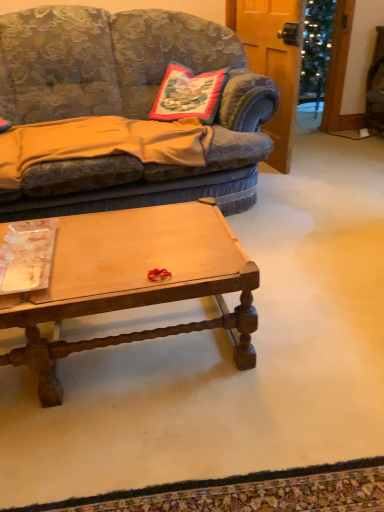
This screenshot has height=512, width=384. Describe the element at coordinates (189, 94) in the screenshot. I see `embroidered fabric pillow at center` at that location.

Where is `velvet fabric couch at center`? Image resolution: width=384 pixels, height=512 pixels. velvet fabric couch at center is located at coordinates [127, 106].

Between light brown wood coffee table at center and embroidered fabric pillow at center, which one has larger size?

With larger size is light brown wood coffee table at center.

From a real-world perspective, is light brown wood coffee table at center located beneath embroidered fabric pillow at center?

Indeed, from a real-world perspective, light brown wood coffee table at center is positioned beneath embroidered fabric pillow at center.

Is point (253, 262) closer or farther from the camera than point (196, 90)?

Clearly, point (253, 262) is closer to the camera than point (196, 90).

Relative to embroidered fabric pillow at center, is light brown wood coffee table at center in front or behind?

Visually, light brown wood coffee table at center is located in front of embroidered fabric pillow at center.

Considering the sizes of objects embroidered fabric pillow at center and velvet fabric couch at center in the image provided, who is smaller, embroidered fabric pillow at center or velvet fabric couch at center?

Smaller between the two is embroidered fabric pillow at center.

Is embroidered fabric pillow at center situated inside velvet fabric couch at center or outside?

embroidered fabric pillow at center lies within the bounds of velvet fabric couch at center.

From a real-world perspective, which object stands above the other?

embroidered fabric pillow at center is physically above.

Locate an element on the screen. This screenshot has width=384, height=512. pillow that is on the right side of velvet fabric couch at center is located at coordinates click(189, 94).

Can we say velvet fabric couch at center lies outside embroidered fabric pillow at center?

Yes, velvet fabric couch at center is located beyond the bounds of embroidered fabric pillow at center.

Considering the relative sizes of velvet fabric couch at center and embroidered fabric pillow at center in the image provided, is velvet fabric couch at center wider than embroidered fabric pillow at center?

Correct, the width of velvet fabric couch at center exceeds that of embroidered fabric pillow at center.

Where is `studio couch in front of the embroidered fabric pillow at center`? The image size is (384, 512). studio couch in front of the embroidered fabric pillow at center is located at coordinates (127, 106).

From the image's perspective, between velvet fabric couch at center and embroidered fabric pillow at center, who is located below?

velvet fabric couch at center, from the image's perspective.

Based on the photo, is orange cotton blanket at left facing towards velvet fabric couch at center?

Yes, orange cotton blanket at left is turned towards velvet fabric couch at center.

Can you confirm if orange cotton blanket at left is thinner than velvet fabric couch at center?

Correct, the width of orange cotton blanket at left is less than that of velvet fabric couch at center.

Looking at this image, is orange cotton blanket at left at the right side of velvet fabric couch at center?

No, orange cotton blanket at left is not to the right of velvet fabric couch at center.

Does orange cotton blanket at left have a smaller size compared to velvet fabric couch at center?

Correct, orange cotton blanket at left occupies less space than velvet fabric couch at center.

From a real-world perspective, is velvet fabric couch at center beneath light brown wood coffee table at center?

Incorrect, from a real-world perspective, velvet fabric couch at center is higher than light brown wood coffee table at center.

From the image's perspective, which object appears higher, velvet fabric couch at center or light brown wood coffee table at center?

From the image's view, velvet fabric couch at center is above.

Considering the positions of points (94, 25) and (102, 298), is point (94, 25) closer to camera compared to point (102, 298)?

No, it is not.

Which object is closer to the camera, velvet fabric couch at center or light brown wood coffee table at center?

light brown wood coffee table at center is more forward.

Does orange cotton blanket at left contain light brown wood coffee table at center?

Definitely not — light brown wood coffee table at center is not inside orange cotton blanket at left.

From the image's perspective, which object appears higher, orange cotton blanket at left or light brown wood coffee table at center?

orange cotton blanket at left, from the image's perspective.

Would you say orange cotton blanket at left is a long distance from light brown wood coffee table at center?

No.

Which object is thinner, orange cotton blanket at left or light brown wood coffee table at center?

light brown wood coffee table at center is thinner.

From the image's perspective, between light brown wood coffee table at center and orange cotton blanket at left, which one is located above?

orange cotton blanket at left, from the image's perspective.

Considering the relative positions of light brown wood coffee table at center and orange cotton blanket at left in the image provided, is light brown wood coffee table at center to the right of orange cotton blanket at left from the viewer's perspective?

Yes, light brown wood coffee table at center is to the right of orange cotton blanket at left.

Considering the sizes of objects light brown wood coffee table at center and orange cotton blanket at left in the image provided, who is shorter, light brown wood coffee table at center or orange cotton blanket at left?

orange cotton blanket at left.

Considering the sizes of objects light brown wood coffee table at center and orange cotton blanket at left in the image provided, who is smaller, light brown wood coffee table at center or orange cotton blanket at left?

With smaller size is orange cotton blanket at left.

Locate an element on the screen. The height and width of the screenshot is (512, 384). coffee table beneath the embroidered fabric pillow at center (from a real-world perspective) is located at coordinates (133, 282).

At what (x,y) coordinates should I click in order to perform the action: click on studio couch in front of the embroidered fabric pillow at center. Please return your answer as a coordinate pair (x, y). Looking at the image, I should click on (127, 106).

Estimate the real-world distances between objects in this image. Which object is closer to velvet fabric couch at center, light brown wood coffee table at center or embroidered fabric pillow at center?

embroidered fabric pillow at center is positioned closer to the anchor velvet fabric couch at center.

Based on their spatial positions, is light brown wood coffee table at center or orange cotton blanket at left further from embroidered fabric pillow at center?

light brown wood coffee table at center is positioned further to the anchor embroidered fabric pillow at center.

Considering their positions, is velvet fabric couch at center positioned further to embroidered fabric pillow at center than light brown wood coffee table at center?

Among the two, light brown wood coffee table at center is located further to embroidered fabric pillow at center.

Looking at the image, which one is located further to light brown wood coffee table at center, embroidered fabric pillow at center or orange cotton blanket at left?

The object further to light brown wood coffee table at center is embroidered fabric pillow at center.

Based on their spatial positions, is orange cotton blanket at left or velvet fabric couch at center closer to embroidered fabric pillow at center?

velvet fabric couch at center lies closer to embroidered fabric pillow at center than the other object.

In the scene shown: Considering their positions, is embroidered fabric pillow at center positioned further to velvet fabric couch at center than light brown wood coffee table at center?

light brown wood coffee table at center lies further to velvet fabric couch at center than the other object.

When comparing their distances from light brown wood coffee table at center, does orange cotton blanket at left or velvet fabric couch at center seem closer?

The object closer to light brown wood coffee table at center is orange cotton blanket at left.

Looking at the image, which one is located further to embroidered fabric pillow at center, velvet fabric couch at center or orange cotton blanket at left?

Among the two, orange cotton blanket at left is located further to embroidered fabric pillow at center.

The image size is (384, 512). I want to click on studio couch between embroidered fabric pillow at center and light brown wood coffee table at center in the up-down direction, so click(127, 106).

Locate an element on the screen. This screenshot has height=512, width=384. blanket positioned between velvet fabric couch at center and embroidered fabric pillow at center from near to far is located at coordinates (101, 143).

The height and width of the screenshot is (512, 384). Find the location of `blanket between velvet fabric couch at center and light brown wood coffee table at center vertically`. blanket between velvet fabric couch at center and light brown wood coffee table at center vertically is located at coordinates (101, 143).

Identify the location of blanket between embroidered fabric pillow at center and light brown wood coffee table at center in the up-down direction. The width and height of the screenshot is (384, 512). (101, 143).